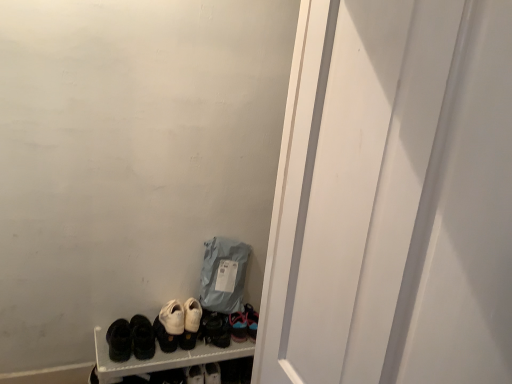
Question: Considering the positions of white suede sneakers at center, which appears as the 3th footwear when viewed from the right, and white matte screen door at center in the image, is white suede sneakers at center, which appears as the 3th footwear when viewed from the right, taller or shorter than white matte screen door at center?

Choices:
 (A) tall
 (B) short

Answer: (B)

Question: Is point (156, 337) closer or farther from the camera than point (474, 152)?

Choices:
 (A) farther
 (B) closer

Answer: (A)

Question: Based on their relative distances, which object is nearer to the matte black shoes at lower left?

Choices:
 (A) black leather sneakers at center, arranged as the fifth footwear when viewed from the left
 (B) matte gray fabric bag at lower center
 (C) white leather sneakers at center, which is counted as the second footwear, starting from the right
 (D) white suede sneakers at center, which appears as the 3th footwear when viewed from the right
 (E) black suede shoes at lower left, placed as the 5th footwear when sorted from right to left

Answer: (D)

Question: Estimate the real-world distances between objects in this image. Which object is closer to the black suede shoes at lower left, placed as the fourth footwear when sorted from right to left?

Choices:
 (A) black suede shoes at lower left, positioned as the first footwear in left-to-right order
 (B) white suede sneakers at center, which appears as the 3th footwear when viewed from the left
 (C) matte black shoes at lower left
 (D) white leather sneakers at center, which is counted as the second footwear, starting from the right
 (E) white matte screen door at center

Answer: (A)